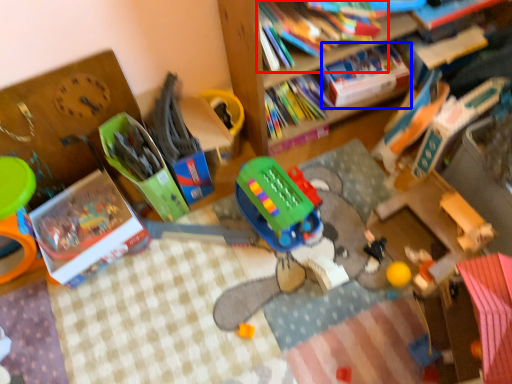
Question: Which of the following is the farthest to the observer, book (highlighted by a red box) or book (highlighted by a blue box)?

Choices:
 (A) book
 (B) book

Answer: (B)